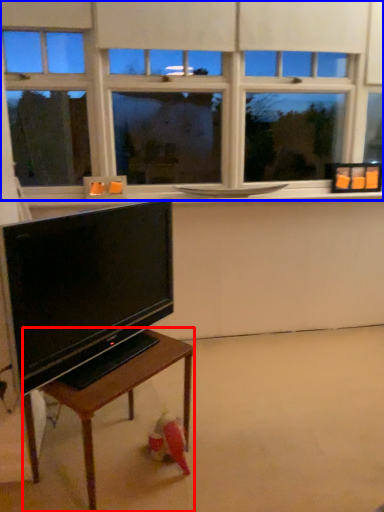
Question: Which of the following is the farthest to the observer, table (highlighted by a red box) or window (highlighted by a blue box)?

Choices:
 (A) table
 (B) window

Answer: (B)